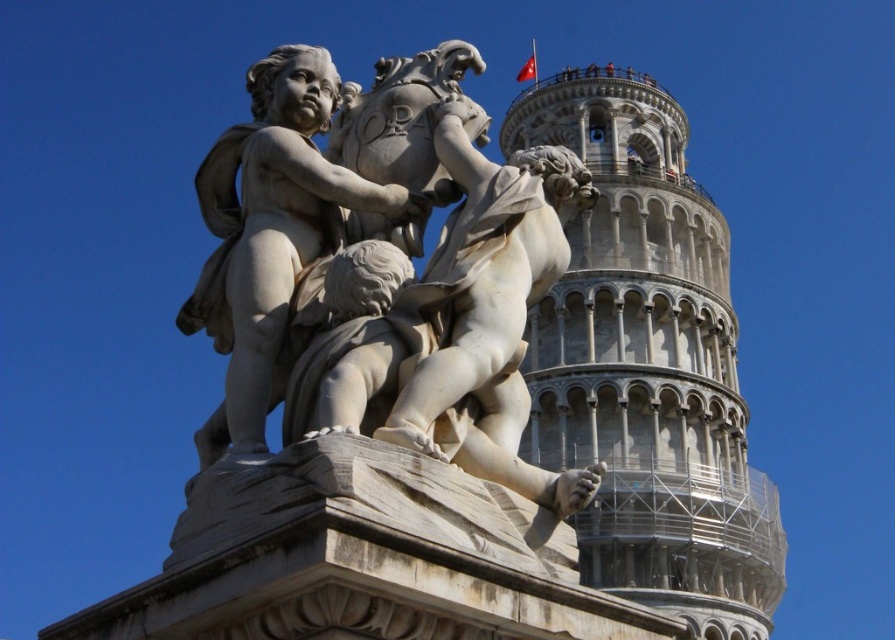
Question: Which of the following is the farthest from the observer?

Choices:
 (A) white marble sculpture at center
 (B) white stone tower at center

Answer: (B)

Question: Does white marble sculpture at center have a larger size compared to white stone tower at center?

Choices:
 (A) yes
 (B) no

Answer: (B)

Question: Can you confirm if white marble sculpture at center is positioned to the left of white stone tower at center?

Choices:
 (A) no
 (B) yes

Answer: (B)

Question: Among these points, which one is farthest from the camera?

Choices:
 (A) (621, 108)
 (B) (305, 285)

Answer: (A)

Question: Is white marble sculpture at center above white stone tower at center?

Choices:
 (A) no
 (B) yes

Answer: (A)

Question: Among these objects, which one is nearest to the camera?

Choices:
 (A) white marble sculpture at center
 (B) white stone tower at center

Answer: (A)